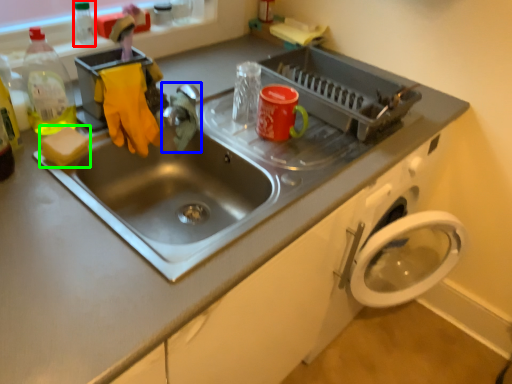
Question: Based on their relative distances, which object is farther from bottle (highlighted by a red box)? Choose from faucet (highlighted by a blue box) and soap (highlighted by a green box).

Choices:
 (A) faucet
 (B) soap

Answer: (B)